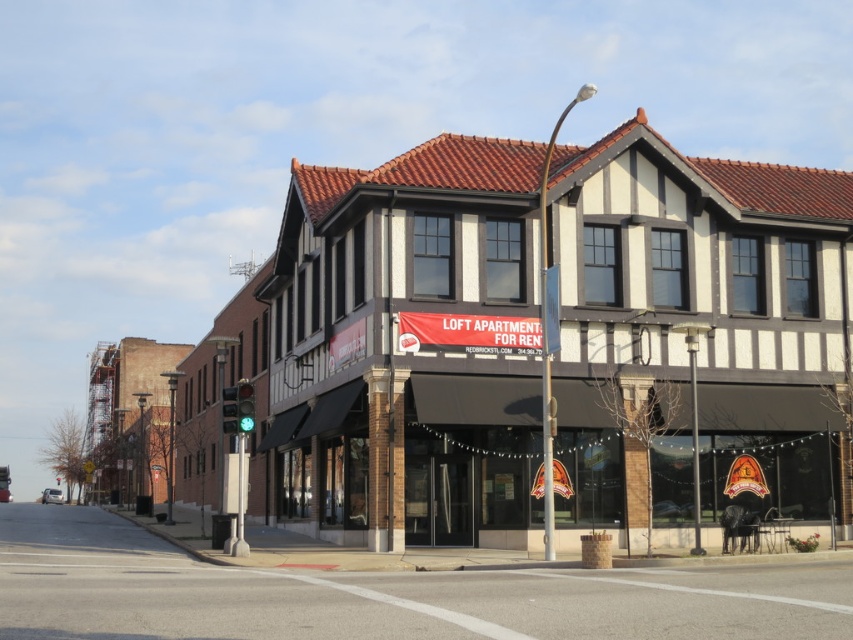
Between white brick building at center and smooth concrete sidewalk at lower center, which one appears on the left side from the viewer's perspective?

From the viewer's perspective, smooth concrete sidewalk at lower center appears more on the left side.

Who is taller, white brick building at center or smooth concrete sidewalk at lower center?

With more height is white brick building at center.

Does point (434, 278) come farther from viewer compared to point (720, 612)?

Yes, it is.

Locate an element on the screen. The width and height of the screenshot is (853, 640). white brick building at center is located at coordinates (409, 344).